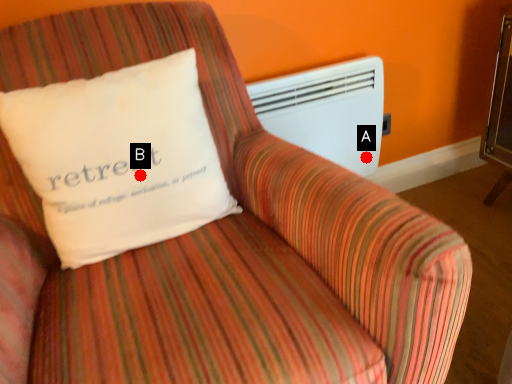
Question: Two points are circled on the image, labeled by A and B beside each circle. Among these points, which one is nearest to the camera?

Choices:
 (A) A is closer
 (B) B is closer

Answer: (B)